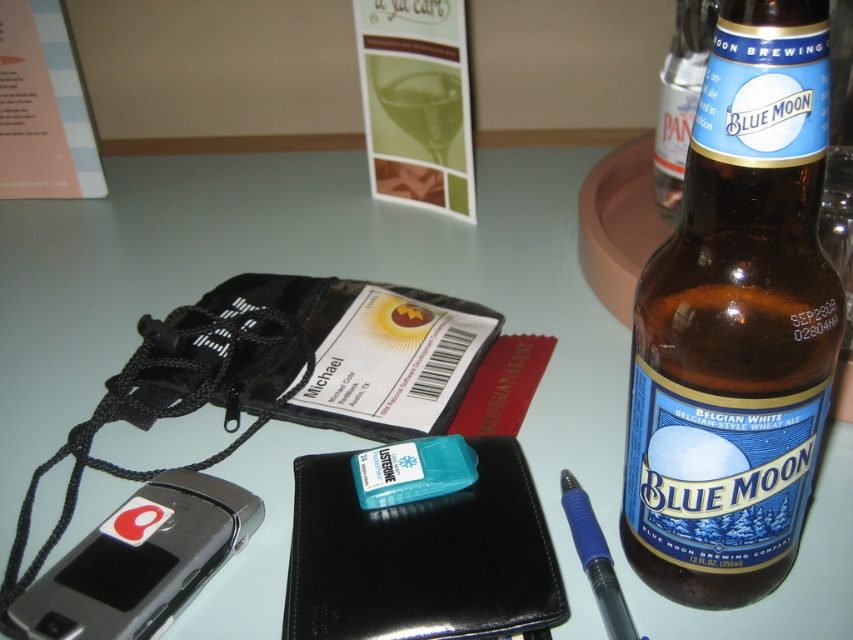
Question: Is brown glass bottle at right further to the viewer compared to blue rubberized pen at right?

Choices:
 (A) no
 (B) yes

Answer: (A)

Question: Estimate the real-world distances between objects in this image. Which object is farther from the blue rubberized pen at right?

Choices:
 (A) silver metallic smartphone at lower left
 (B) brown glass bottle at upper right

Answer: (B)

Question: Where is silver metallic smartphone at lower left located in relation to brown glass bottle at upper right in the image?

Choices:
 (A) above
 (B) below

Answer: (B)

Question: Estimate the real-world distances between objects in this image. Which object is farther from the brown glass bottle at right?

Choices:
 (A) green glass at upper center
 (B) brown glass bottle at upper right

Answer: (A)

Question: From the image, what is the correct spatial relationship of silver metallic smartphone at lower left in relation to brown glass bottle at upper right?

Choices:
 (A) below
 (B) above

Answer: (A)

Question: Among these points, which one is farthest from the camera?

Choices:
 (A) (602, 596)
 (B) (444, 97)
 (C) (755, 515)

Answer: (B)